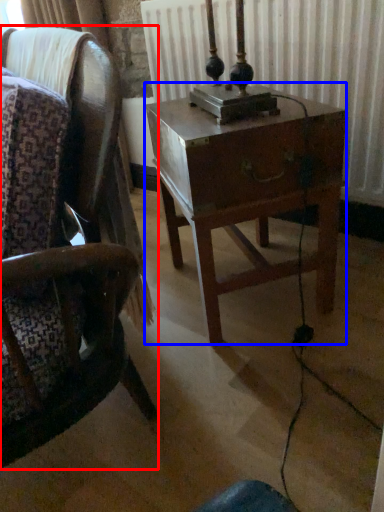
Question: Among these objects, which one is nearest to the camera, chair (highlighted by a red box) or nightstand (highlighted by a blue box)?

Choices:
 (A) chair
 (B) nightstand

Answer: (A)